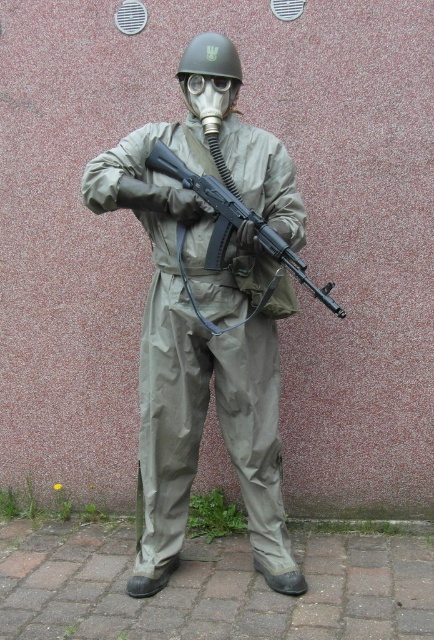
In the scene shown: Is matte khaki uniform at center shorter than transparent plastic goggles at center?

In fact, matte khaki uniform at center may be taller than transparent plastic goggles at center.

Can you confirm if matte khaki uniform at center is positioned below transparent plastic goggles at center?

Yes.

Where is `matte khaki uniform at center`? This screenshot has width=434, height=640. matte khaki uniform at center is located at coordinates (197, 358).

Based on the photo, which is more to the left, matte khaki uniform at center or matte black helmet at center?

Positioned to the left is matte khaki uniform at center.

Who is higher up, matte khaki uniform at center or matte black helmet at center?

matte black helmet at center is above.

Describe the element at coordinates (197, 358) in the screenshot. The height and width of the screenshot is (640, 434). I see `matte khaki uniform at center` at that location.

Locate an element on the screen. This screenshot has height=640, width=434. matte khaki uniform at center is located at coordinates (197, 358).

Is point (163, 157) positioned behind point (194, 90)?

No, it is not.

Who is positioned more to the left, matte black rifle at center or transparent plastic goggles at center?

transparent plastic goggles at center

Between point (286, 241) and point (207, 81), which one is positioned in front?

Positioned in front is point (286, 241).

Find the location of `matte black rifle at center`. matte black rifle at center is located at coordinates (232, 232).